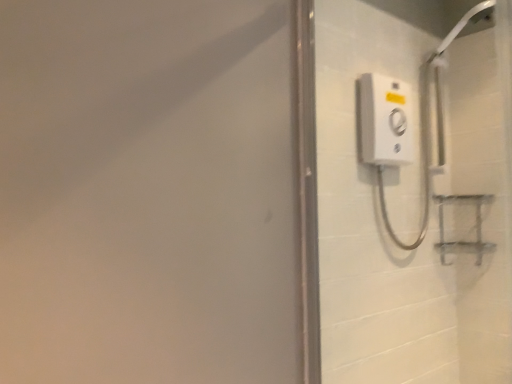
Question: Does white plastic shower control at right have a greater width compared to white plastic shower at upper right?

Choices:
 (A) no
 (B) yes

Answer: (A)

Question: From the image's perspective, is white plastic shower control at right above white plastic shower at upper right?

Choices:
 (A) no
 (B) yes

Answer: (A)

Question: Does white plastic shower control at right have a lesser height compared to white plastic shower at upper right?

Choices:
 (A) no
 (B) yes

Answer: (A)

Question: Can you confirm if white plastic shower control at right is smaller than white plastic shower at upper right?

Choices:
 (A) no
 (B) yes

Answer: (B)

Question: Is white plastic shower control at right behind white plastic shower at upper right?

Choices:
 (A) no
 (B) yes

Answer: (A)

Question: Could you tell me if white plastic shower control at right is facing white plastic shower at upper right?

Choices:
 (A) yes
 (B) no

Answer: (A)

Question: Is white plastic shower at upper right turned away from white plastic shower control at right?

Choices:
 (A) yes
 (B) no

Answer: (B)

Question: Can you confirm if white plastic shower at upper right is positioned to the left of white plastic shower control at right?

Choices:
 (A) yes
 (B) no

Answer: (B)

Question: Is white plastic shower at upper right outside of white plastic shower control at right?

Choices:
 (A) yes
 (B) no

Answer: (A)

Question: Is white plastic shower at upper right oriented towards white plastic shower control at right?

Choices:
 (A) no
 (B) yes

Answer: (A)

Question: Is the surface of white plastic shower at upper right in direct contact with white plastic shower control at right?

Choices:
 (A) no
 (B) yes

Answer: (A)

Question: From a real-world perspective, is white plastic shower at upper right on white plastic shower control at right?

Choices:
 (A) yes
 (B) no

Answer: (A)

Question: Is white plastic shower at upper right inside the boundaries of white plastic shower control at right, or outside?

Choices:
 (A) outside
 (B) inside

Answer: (A)